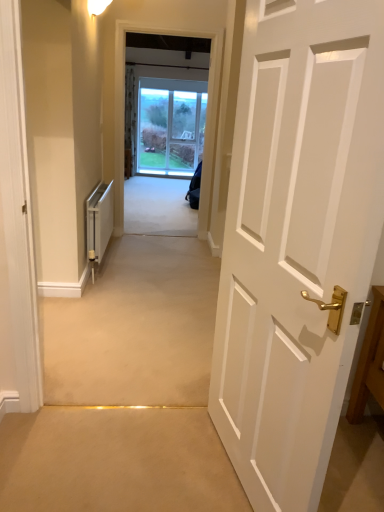
What are the coordinates of `white painted wood door at right` in the screenshot? It's located at (297, 239).

Describe the element at coordinates (297, 239) in the screenshot. I see `white painted wood door at right` at that location.

Locate an element on the screen. white metallic radiator at left is located at coordinates (98, 223).

The height and width of the screenshot is (512, 384). What do you see at coordinates (98, 223) in the screenshot?
I see `white metallic radiator at left` at bounding box center [98, 223].

What is the approximate width of white metallic radiator at left?

The width of white metallic radiator at left is 4.98 inches.

Identify the location of white painted wood door at right. (297, 239).

Which object is positioned more to the left, white metallic radiator at left or white painted wood door at right?

white metallic radiator at left is more to the left.

Relative to white painted wood door at right, is white metallic radiator at left in front or behind?

Visually, white metallic radiator at left is located behind white painted wood door at right.

Considering the positions of point (90, 256) and point (268, 257), is point (90, 256) closer or farther from the camera than point (268, 257)?

Point (90, 256) is positioned farther from the camera compared to point (268, 257).

Based on the photo, from the image's perspective, is white metallic radiator at left located above or below white painted wood door at right?

From the image's perspective, white metallic radiator at left appears above white painted wood door at right.

From a real-world perspective, is white metallic radiator at left physically above white painted wood door at right?

No, from a real-world perspective, white metallic radiator at left is not above white painted wood door at right.

Is white metallic radiator at left wider than white painted wood door at right?

Yes, white metallic radiator at left is wider than white painted wood door at right.

Which of these two, white metallic radiator at left or white painted wood door at right, stands shorter?

With less height is white metallic radiator at left.

Which of these two, white metallic radiator at left or white painted wood door at right, is bigger?

white painted wood door at right is bigger.

Do you think white metallic radiator at left is within white painted wood door at right, or outside of it?

white metallic radiator at left exists outside the volume of white painted wood door at right.

Is white metallic radiator at left with white painted wood door at right?

No, white metallic radiator at left is not with white painted wood door at right.

Could you tell me if white metallic radiator at left is turned towards white painted wood door at right?

No, white metallic radiator at left is not facing towards white painted wood door at right.

What's the angular difference between white metallic radiator at left and white painted wood door at right's facing directions?

173 degrees separate the facing orientations of white metallic radiator at left and white painted wood door at right.

How distant is white metallic radiator at left from white painted wood door at right?

2.16 meters.

Identify the location of door that appears in front of the white metallic radiator at left. coord(297,239).

Is white painted wood door at right to the right of white metallic radiator at left from the viewer's perspective?

Indeed, white painted wood door at right is positioned on the right side of white metallic radiator at left.

Is white painted wood door at right closer to camera compared to white metallic radiator at left?

Yes, white painted wood door at right is closer to the camera.

Does point (312, 350) appear closer or farther from the camera than point (101, 242)?

Point (312, 350).

From the image's perspective, is white painted wood door at right beneath white metallic radiator at left?

Yes, from the image's perspective, white painted wood door at right is below white metallic radiator at left.

From a real-world perspective, relative to white metallic radiator at left, is white painted wood door at right vertically above or below?

white painted wood door at right is above white metallic radiator at left.

Looking at their sizes, would you say white painted wood door at right is wider or thinner than white metallic radiator at left?

Clearly, white painted wood door at right has less width compared to white metallic radiator at left.

Can you confirm if white painted wood door at right is shorter than white metallic radiator at left?

In fact, white painted wood door at right may be taller than white metallic radiator at left.

Can you confirm if white painted wood door at right is bigger than white metallic radiator at left?

Yes.

Is white metallic radiator at left completely or partially inside white painted wood door at right?

No, white painted wood door at right does not contain white metallic radiator at left.

Is white painted wood door at right in contact with white metallic radiator at left?

No, white painted wood door at right is not making contact with white metallic radiator at left.

Looking at this image, is white painted wood door at right facing away from white metallic radiator at left?

That's not correct — white painted wood door at right is not looking away from white metallic radiator at left.

How different are the orientations of white painted wood door at right and white metallic radiator at left in degrees?

The angular difference between white painted wood door at right and white metallic radiator at left is 173 degrees.

The height and width of the screenshot is (512, 384). I want to click on appliance located behind the white painted wood door at right, so click(x=98, y=223).

Where is `door above the white metallic radiator at left (from a real-world perspective)`? The width and height of the screenshot is (384, 512). door above the white metallic radiator at left (from a real-world perspective) is located at coordinates (297, 239).

What are the coordinates of `appliance above the white painted wood door at right (from the image's perspective)` in the screenshot? It's located at (98, 223).